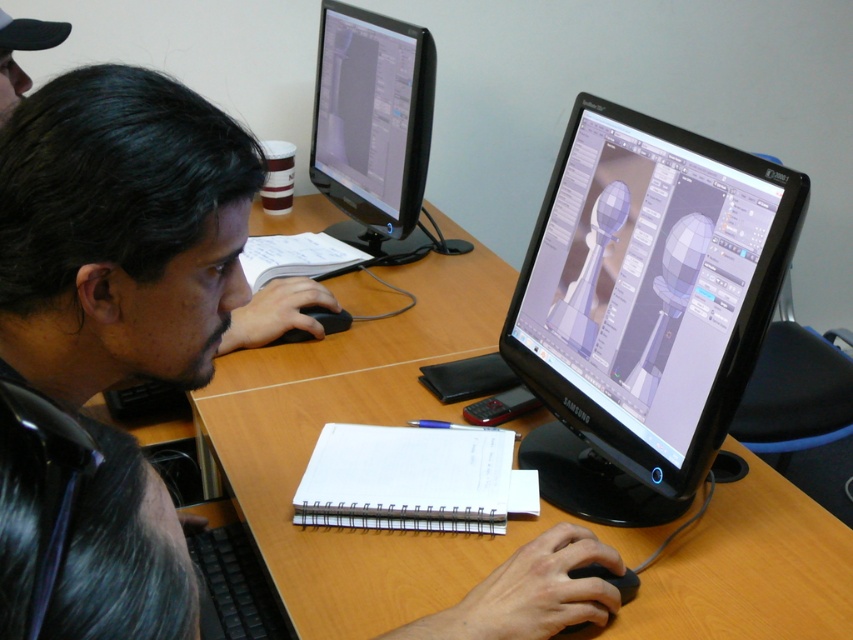
Between black glossy monitor at center and black matte laptop at upper left, which one has less height?

Standing shorter between the two is black matte laptop at upper left.

Does black glossy monitor at center come behind black matte laptop at upper left?

Yes, it is.

What do you see at coordinates (643, 308) in the screenshot? I see `black glossy monitor at center` at bounding box center [643, 308].

Identify the location of black glossy monitor at center. This screenshot has width=853, height=640. (643, 308).

Is wooden desk at center closer to camera compared to black matte laptop at upper left?

No.

Is point (846, 627) less distant than point (154, 264)?

No, (846, 627) is behind (154, 264).

Where is `wooden desk at center`? wooden desk at center is located at coordinates (370, 422).

Who is positioned more to the left, black glossy monitor at center or black plastic keyboard at lower left?

From the viewer's perspective, black plastic keyboard at lower left appears more on the left side.

Between point (699, 396) and point (222, 556), which one is positioned in front?

Point (699, 396)

Image resolution: width=853 pixels, height=640 pixels. What are the coordinates of `black glossy monitor at center` in the screenshot? It's located at (643, 308).